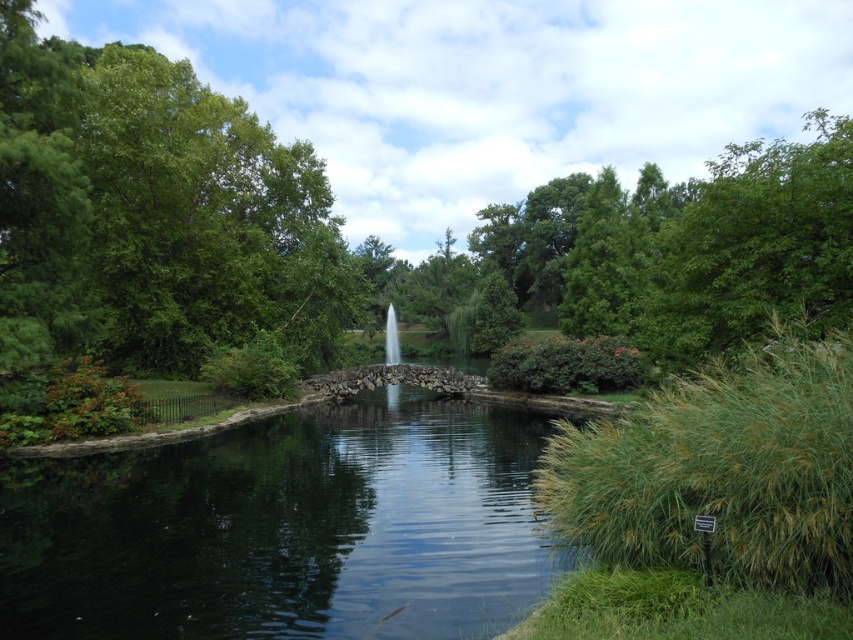
Question: Which object is farther from the camera taking this photo?

Choices:
 (A) green leafy tree at upper right
 (B) green leafy tree at left

Answer: (B)

Question: Observing the image, what is the correct spatial positioning of green leafy tree at left in reference to green leafy tree at upper right?

Choices:
 (A) left
 (B) right

Answer: (A)

Question: Based on their relative distances, which object is farther from the green leafy tree at upper right?

Choices:
 (A) white glossy waterfall at center
 (B) green leafy tree at left

Answer: (A)

Question: Can you confirm if green leafy tree at left is bigger than white glossy waterfall at center?

Choices:
 (A) yes
 (B) no

Answer: (A)

Question: Can you confirm if green leafy tree at upper right is positioned below white glossy waterfall at center?

Choices:
 (A) no
 (B) yes

Answer: (A)

Question: Among these objects, which one is nearest to the camera?

Choices:
 (A) green leafy tree at upper right
 (B) white glossy waterfall at center

Answer: (A)